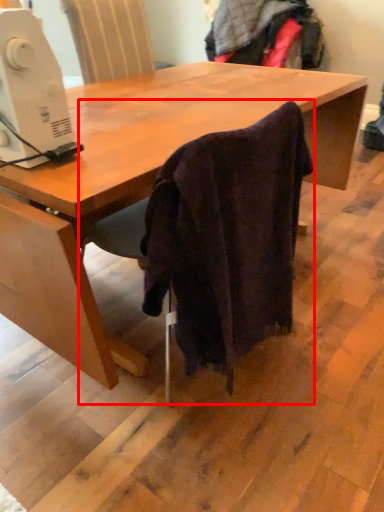
Question: In this image, where is chair (annotated by the red box) located relative to sewing machine?

Choices:
 (A) right
 (B) left

Answer: (A)